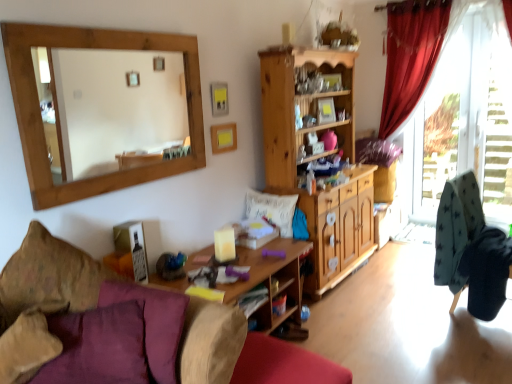
Question: Is wooden mirror at upper left not inside red velvet curtain at right?

Choices:
 (A) no
 (B) yes

Answer: (B)

Question: Is wooden mirror at upper left to the right of red velvet curtain at right from the viewer's perspective?

Choices:
 (A) yes
 (B) no

Answer: (B)

Question: Is red velvet curtain at right at the back of wooden mirror at upper left?

Choices:
 (A) no
 (B) yes

Answer: (A)

Question: From a real-world perspective, is wooden mirror at upper left physically below red velvet curtain at right?

Choices:
 (A) no
 (B) yes

Answer: (A)

Question: From the image's perspective, does wooden mirror at upper left appear lower than red velvet curtain at right?

Choices:
 (A) yes
 (B) no

Answer: (A)

Question: Is wooden picture frame at upper center spatially inside white soft cushion at center, the first pillow viewed from the back, or outside of it?

Choices:
 (A) outside
 (B) inside

Answer: (A)

Question: Considering the positions of point (236, 140) and point (294, 206), is point (236, 140) closer or farther from the camera than point (294, 206)?

Choices:
 (A) farther
 (B) closer

Answer: (A)

Question: Is wooden picture frame at upper center to the left or to the right of white soft cushion at center, arranged as the first pillow when viewed from the right, in the image?

Choices:
 (A) right
 (B) left

Answer: (B)

Question: Is wooden picture frame at upper center wider or thinner than white soft cushion at center, arranged as the first pillow when viewed from the right?

Choices:
 (A) thin
 (B) wide

Answer: (A)

Question: From a real-world perspective, is velvet purple cushion at lower left above or below transparent glass door at right?

Choices:
 (A) above
 (B) below

Answer: (B)

Question: From the image's perspective, is velvet purple cushion at lower left above or below transparent glass door at right?

Choices:
 (A) above
 (B) below

Answer: (B)

Question: Would you say velvet purple cushion at lower left is inside or outside transparent glass door at right?

Choices:
 (A) inside
 (B) outside

Answer: (B)

Question: Considering their positions, is velvet purple cushion at lower left located in front of or behind transparent glass door at right?

Choices:
 (A) behind
 (B) front

Answer: (B)

Question: Looking at the image, does velvet purple pillow at lower left, marked as the 2th pillow in a back-to-front arrangement, seem bigger or smaller compared to woodenmaterial/texturetable at center?

Choices:
 (A) small
 (B) big

Answer: (A)

Question: From their relative heights in the image, would you say velvet purple pillow at lower left, placed as the first pillow when sorted from left to right, is taller or shorter than woodenmaterial/texturetable at center?

Choices:
 (A) tall
 (B) short

Answer: (B)